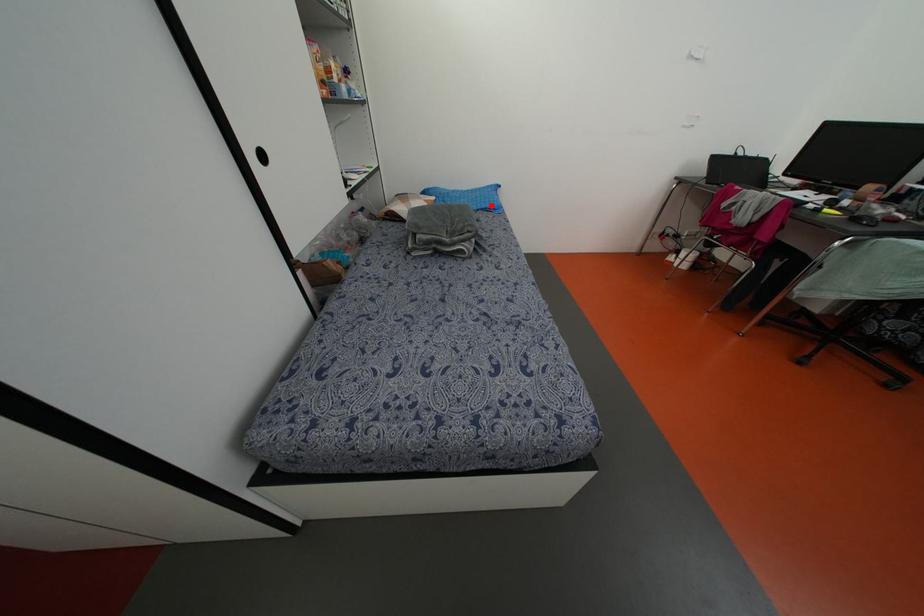
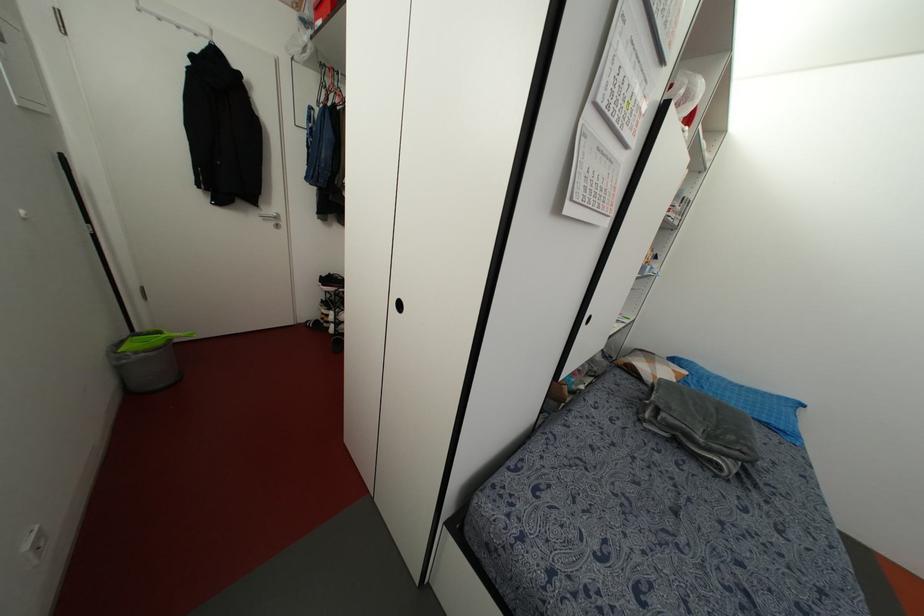
Where in the second image is the point corresponding to the highlighted location from the first image?

(782, 427)